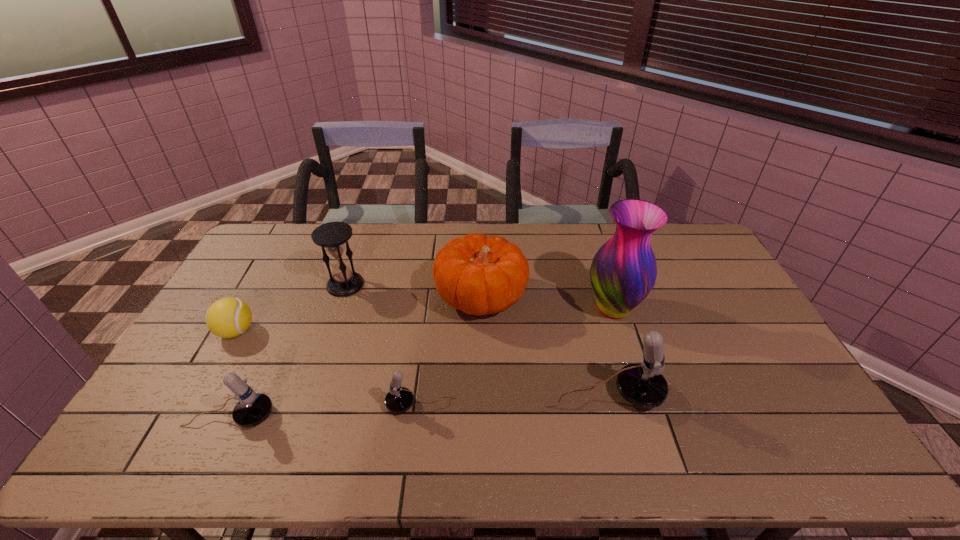
The width and height of the screenshot is (960, 540). What are the coordinates of `free space between the shortest microphone and the pumpkin` in the screenshot? It's located at (451, 352).

At what (x,y) coordinates should I click in order to perform the action: click on object that is the fourth closest to the second tallest microphone. Please return your answer as a coordinate pair (x, y). The height and width of the screenshot is (540, 960). Looking at the image, I should click on (479, 275).

Select which object is the fourth closest to the tallest microphone. Please provide its 2D coordinates. Your answer should be formatted as a tuple, i.e. [(x, y)], where the tuple contains the x and y coordinates of a point satisfying the conditions above.

[(333, 237)]

Locate an element on the screen. The image size is (960, 540). microphone that is the closest to the shortest microphone is located at coordinates (643, 385).

Select which microphone appears as the second closest to the rightmost microphone. Please provide its 2D coordinates. Your answer should be formatted as a tuple, i.e. [(x, y)], where the tuple contains the x and y coordinates of a point satisfying the conditions above.

[(253, 408)]

Locate an element on the screen. The width and height of the screenshot is (960, 540). vacant space that satisfies the following two spatial constraints: 1. on the front side of the pumpkin; 2. on the right side of the hourglass is located at coordinates (341, 298).

Locate an element on the screen. This screenshot has height=540, width=960. free location that satisfies the following two spatial constraints: 1. on the back side of the second microphone from left to right; 2. on the left side of the pumpkin is located at coordinates (433, 298).